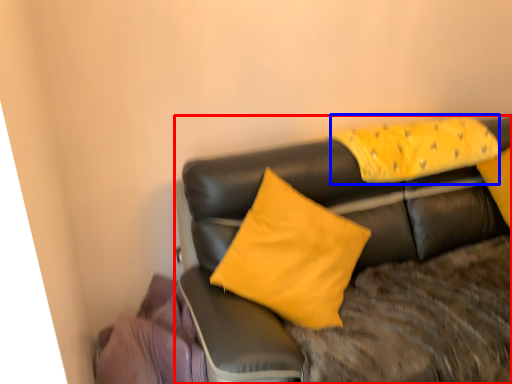
Question: Which point is further to the camera, studio couch (highlighted by a red box) or pillow (highlighted by a blue box)?

Choices:
 (A) studio couch
 (B) pillow

Answer: (B)